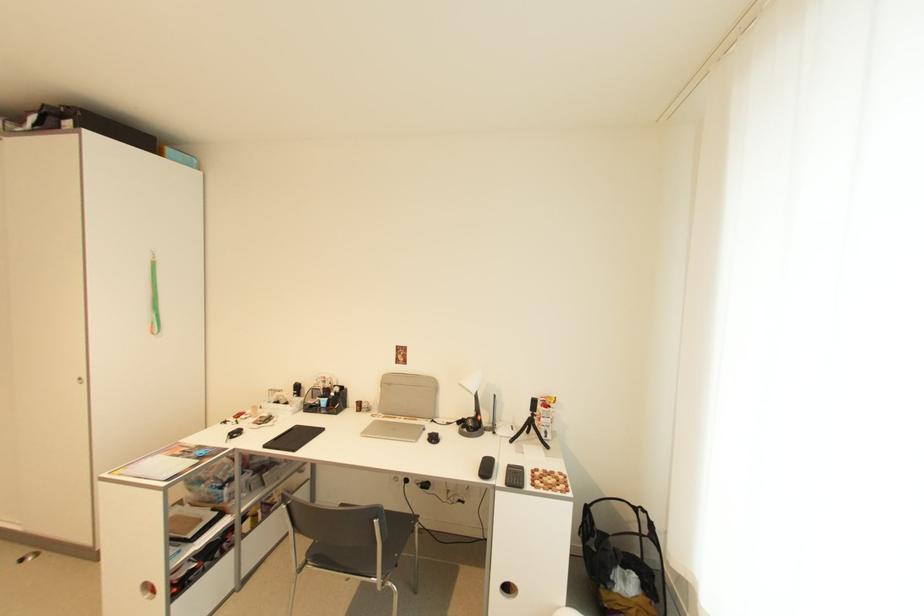
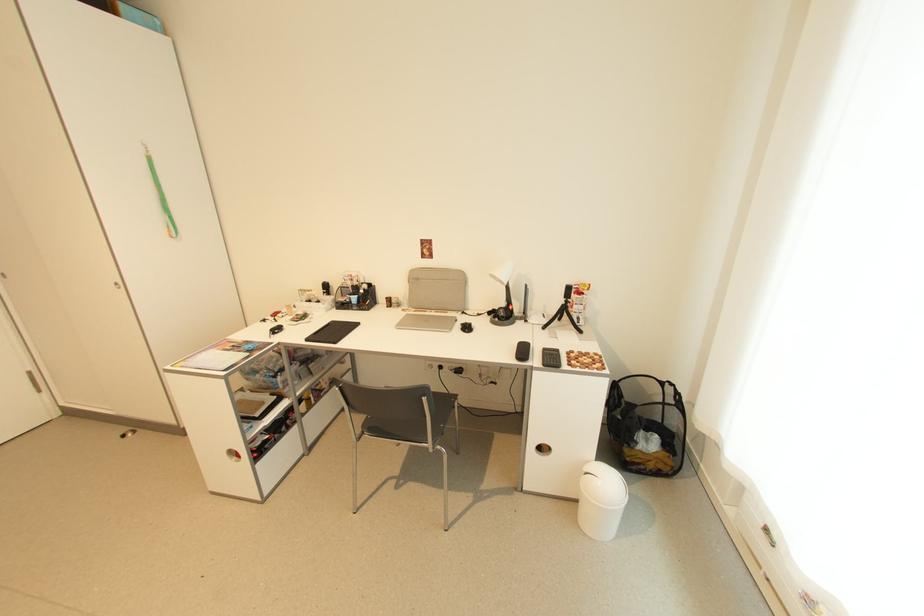
Locate, in the second image, the point that corresponds to point 157,329 in the first image.

(175, 233)